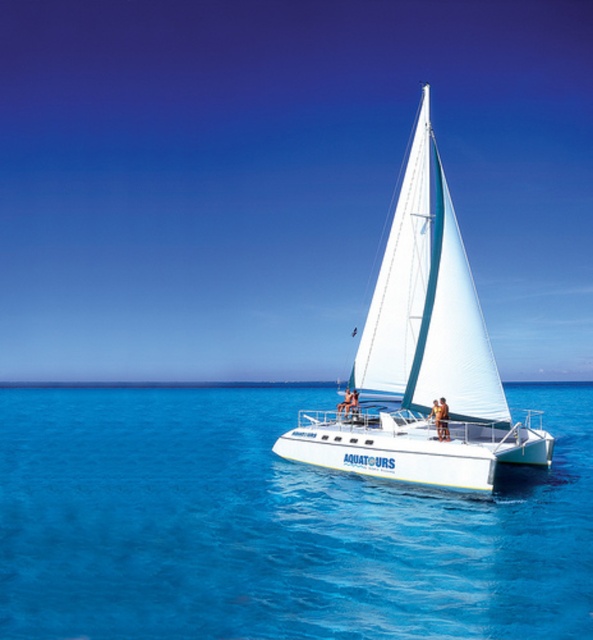
You are a passenger on the white matte sailboat at center and want to jump into the blue liquid water at center. Based on the scene description, can you safely jump into the water from the boat?

The blue liquid water at center is closer to the viewer than the white matte sailboat at center, so the boat is further away from you. Therefore, jumping from the boat into the water would be safe as the distance between them is manageable.

You are standing on the deck of the sailboat named Aquatours and looking towards the point marked as point (275, 525). What do you see there?

At point (275, 525) lies blue liquid water at center.

You are a photographer taking a picture of the sailboat named Aquatours. You notice two points on the image at coordinates point (192, 422) and point (444, 250). Which point is closer to the camera?

Point (192, 422) is further to the camera than point (444, 250).